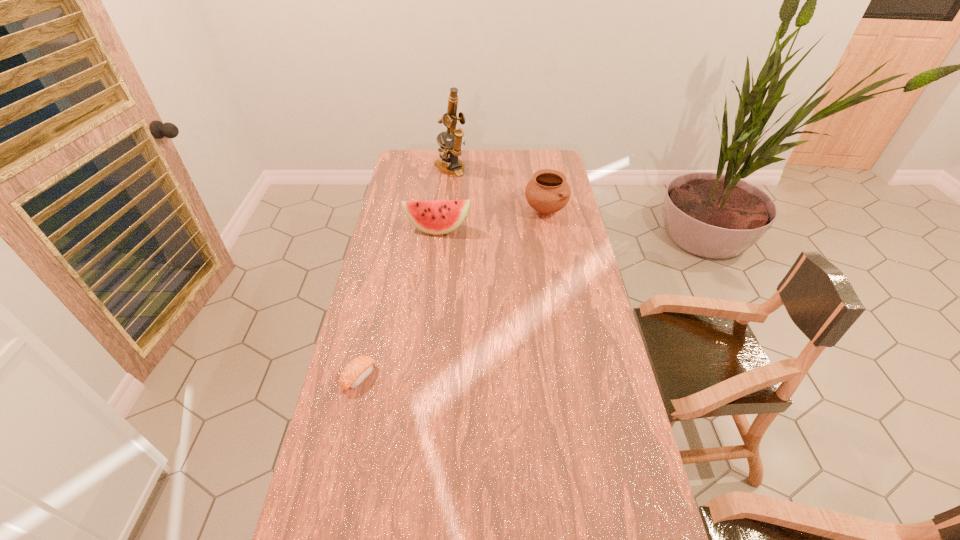
Locate an element on the screen. The width and height of the screenshot is (960, 540). object located in the far edge section of the desktop is located at coordinates (450, 150).

Where is `watermelon positioned at the left edge`? This screenshot has height=540, width=960. watermelon positioned at the left edge is located at coordinates (437, 217).

Identify the location of sushi that is positioned at the left edge. (355, 372).

Locate an element on the screen. The image size is (960, 540). object that is at the right edge is located at coordinates (548, 192).

Find the location of `free space at the far edge of the desktop`. free space at the far edge of the desktop is located at coordinates (495, 169).

Identify the location of vacant region at the left edge of the desktop. (349, 453).

In the image, there is a desktop. At what (x,y) coordinates should I click in order to perform the action: click on vacant space at the right edge. Please return your answer as a coordinate pair (x, y). Image resolution: width=960 pixels, height=540 pixels. Looking at the image, I should click on (591, 444).

You are a GUI agent. You are given a task and a screenshot of the screen. Output one action in this format:
    pyautogui.click(x=<x>, y=<y>)
    Task: Click on the free spot at the far left corner of the desktop
    The image size is (960, 540).
    Given the screenshot: What is the action you would take?
    click(412, 171)

The height and width of the screenshot is (540, 960). In order to click on vacant space at the far right corner of the desktop in this screenshot , I will do `click(549, 163)`.

This screenshot has width=960, height=540. In order to click on free space between the shortest object and the pottery in this screenshot , I will do `click(452, 293)`.